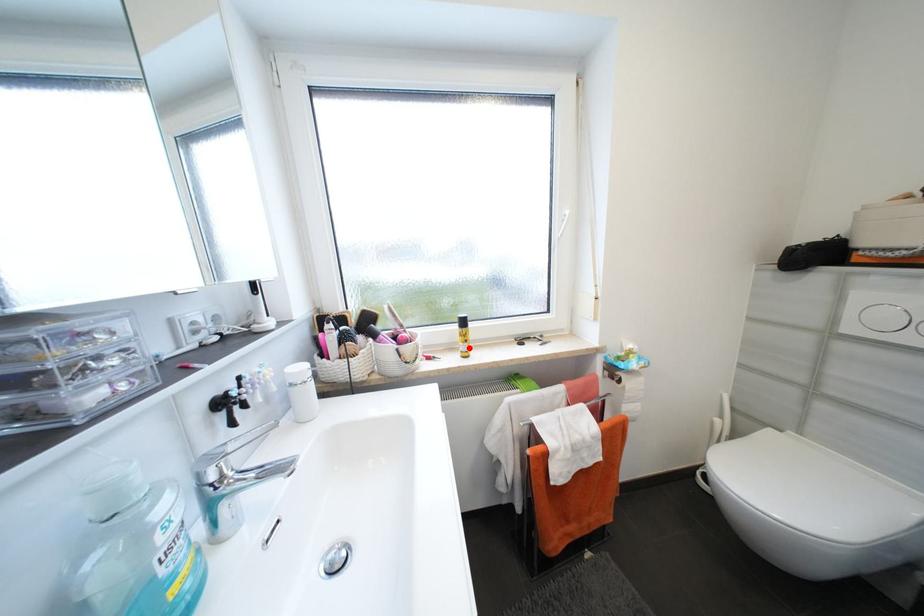
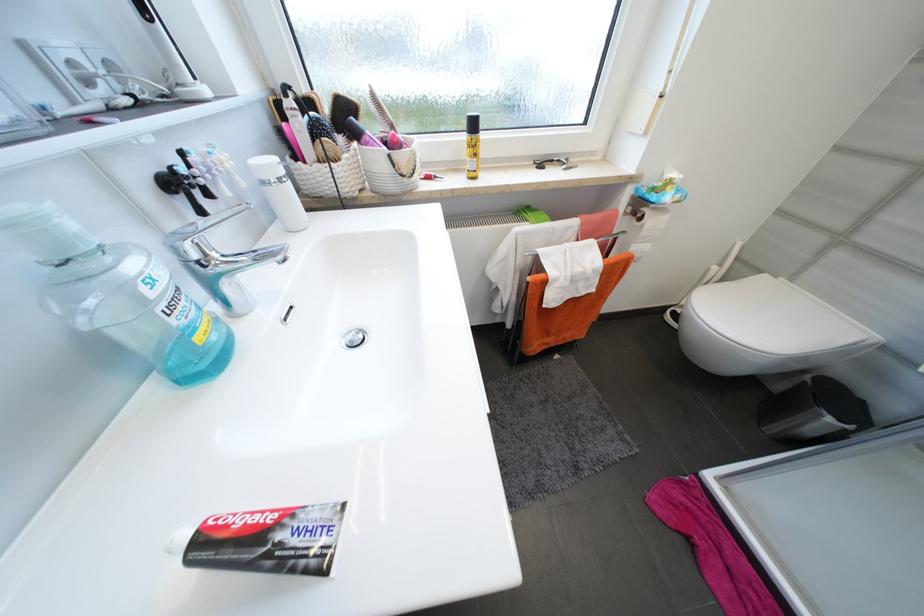
In the second image, find the point that corresponds to the highlighted location in the first image.

(477, 166)